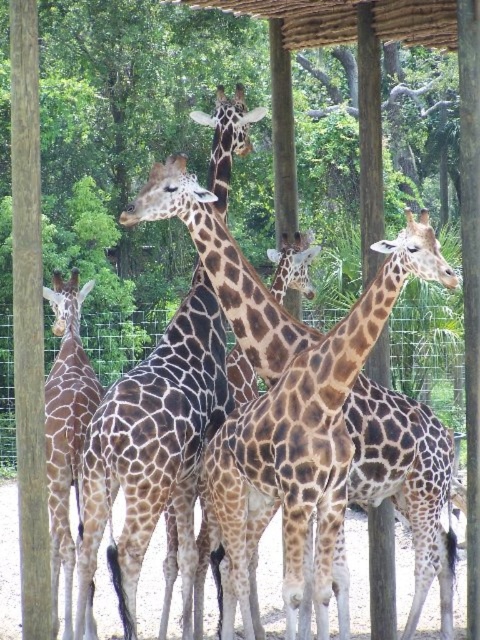
Who is positioned more to the left, brown spotted giraffe at center or brown spotted giraffe at left?

Positioned to the left is brown spotted giraffe at left.

Is point (235, 481) in front of point (64, 484)?

Yes, it is.

Identify the location of brown spotted giraffe at center. The width and height of the screenshot is (480, 640). (287, 401).

Where is `brown spotted giraffe at center`? Image resolution: width=480 pixels, height=640 pixels. brown spotted giraffe at center is located at coordinates (287, 401).

Is brown spotted giraffe at center closer to camera compared to brown wood pole at left?

Yes, brown spotted giraffe at center is in front of brown wood pole at left.

Between brown spotted giraffe at center and brown wood pole at left, which one has more height?

brown wood pole at left is taller.

What do you see at coordinates (287, 401) in the screenshot?
I see `brown spotted giraffe at center` at bounding box center [287, 401].

In order to click on brown spotted giraffe at center in this screenshot , I will do `click(287, 401)`.

Does point (60, 280) lie in front of point (470, 84)?

No, (60, 280) is further to viewer.

Who is more distant from viewer, (93, 280) or (477, 81)?

Point (93, 280)

Locate an element on the screen. This screenshot has height=640, width=480. brown spotted giraffe at left is located at coordinates (66, 428).